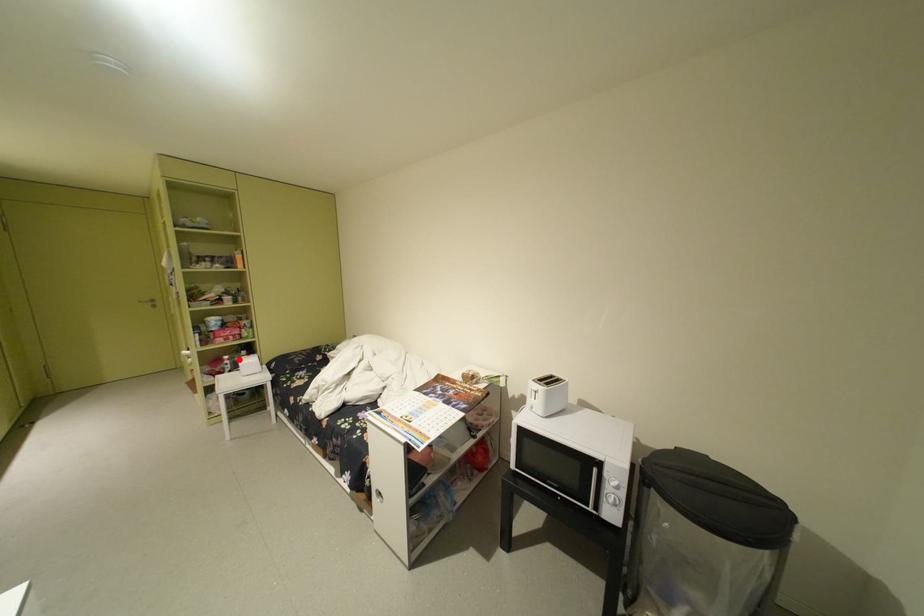
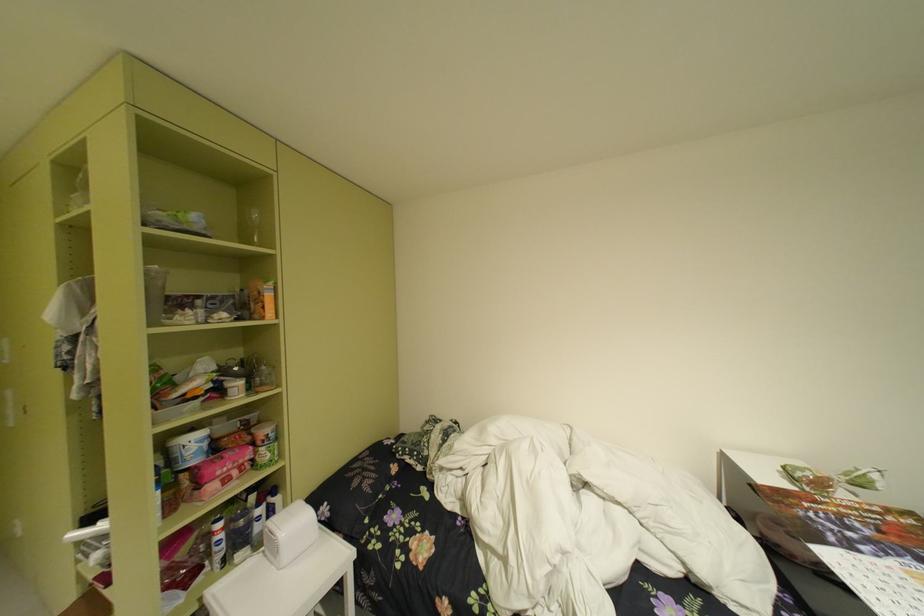
Where in the second image is the point corresponding to the highlighted location from the first image?

(235, 528)